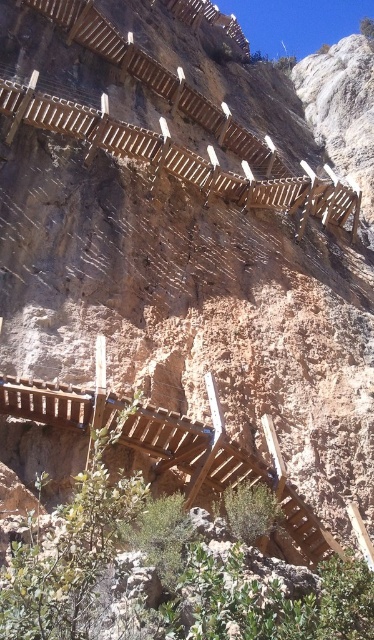
Question: Can you confirm if brown wooden balustrade at center is positioned to the left of wooden at upper center?

Choices:
 (A) no
 (B) yes

Answer: (B)

Question: Which point is farther to the camera?

Choices:
 (A) brown wooden balustrade at center
 (B) wooden at upper center

Answer: (B)

Question: Can you confirm if brown wooden balustrade at center is positioned above wooden at upper center?

Choices:
 (A) yes
 (B) no

Answer: (B)

Question: From the image, what is the correct spatial relationship of brown wooden balustrade at center in relation to wooden at upper center?

Choices:
 (A) above
 (B) below

Answer: (B)